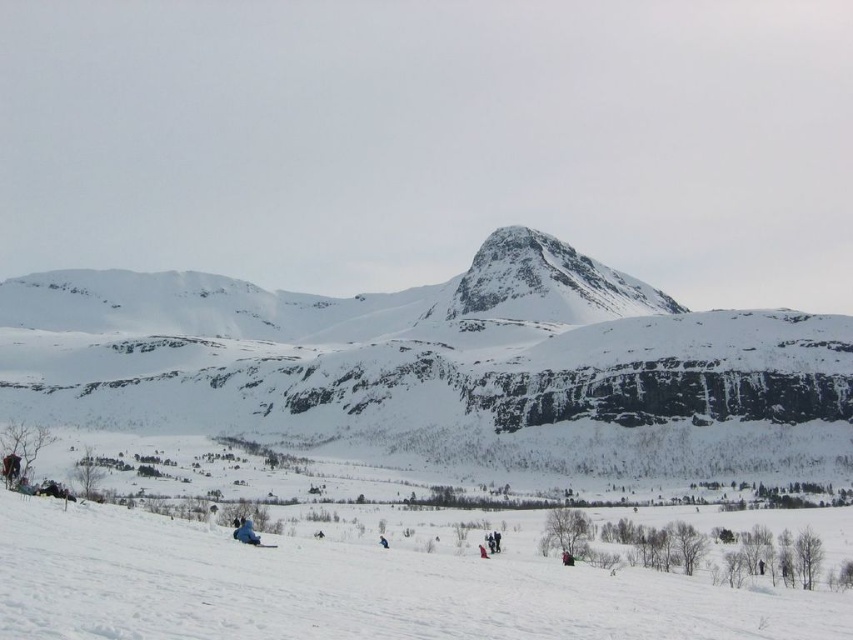
You are standing at the bottom of the slope and see two points marked in the image. Which point is closer to you, point (6, 522) or point (250, 541)?

Point (6, 522) is in front of point (250, 541), so it is closer to you.